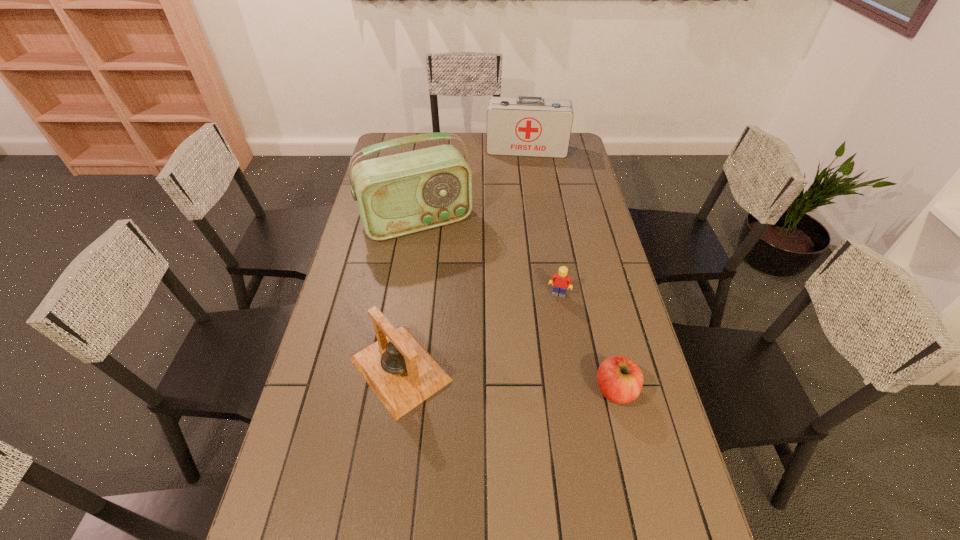
Where is `blank space located 0.300m on the front panel of the second farthest object`? blank space located 0.300m on the front panel of the second farthest object is located at coordinates (466, 304).

Locate an element on the screen. This screenshot has width=960, height=540. vacant position located on the front panel of the second farthest object is located at coordinates (449, 272).

The width and height of the screenshot is (960, 540). I want to click on blank area located 0.270m on the front-facing side of the Lego, so click(535, 369).

Find the location of `vacant space located on the front-facing side of the Lego`. vacant space located on the front-facing side of the Lego is located at coordinates (548, 322).

This screenshot has width=960, height=540. Find the location of `vacant point located on the front-facing side of the Lego`. vacant point located on the front-facing side of the Lego is located at coordinates (536, 366).

At what (x,y) coordinates should I click in order to perform the action: click on vacant region located 0.180m on the front-facing side of the first-aid kit. Please return your answer as a coordinate pair (x, y). Looking at the image, I should click on (523, 181).

Where is `free point located 0.130m on the front-facing side of the first-aid kit`? Image resolution: width=960 pixels, height=540 pixels. free point located 0.130m on the front-facing side of the first-aid kit is located at coordinates (523, 174).

Find the location of a particular element. The height and width of the screenshot is (540, 960). vacant space located on the front-facing side of the first-aid kit is located at coordinates (523, 174).

Where is `object situated at the far edge`? The image size is (960, 540). object situated at the far edge is located at coordinates (526, 126).

Where is `bell present at the left edge`? This screenshot has height=540, width=960. bell present at the left edge is located at coordinates (402, 374).